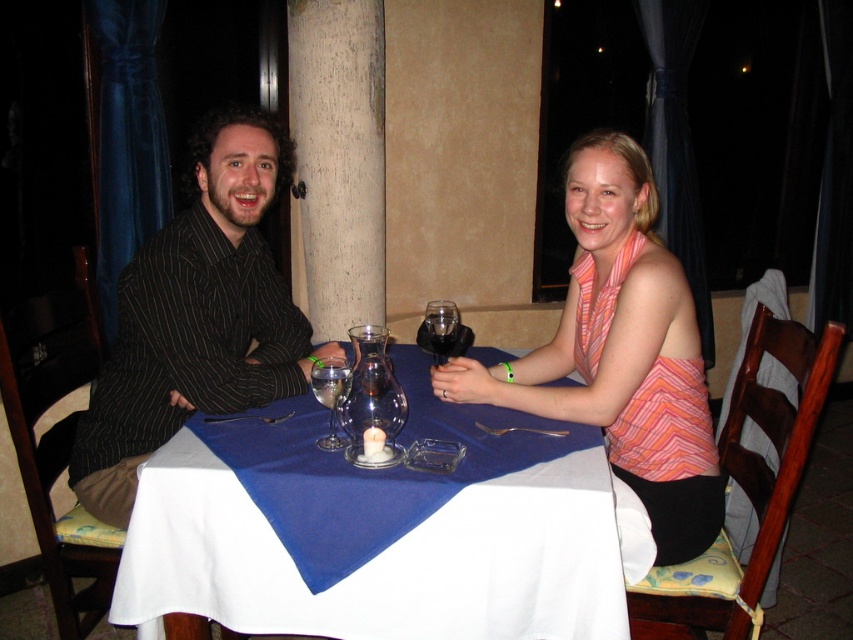
You are a photographer adjusting the camera focus for a group photo. The subjects are wearing the black striped shirt at left and the pink striped tank top at center. Which subject should you focus on first if you want to ensure both are in focus, considering their sizes?

The black striped shirt at left is larger in size than the pink striped tank top at center, so focusing on the larger subject first would help ensure both are in focus.